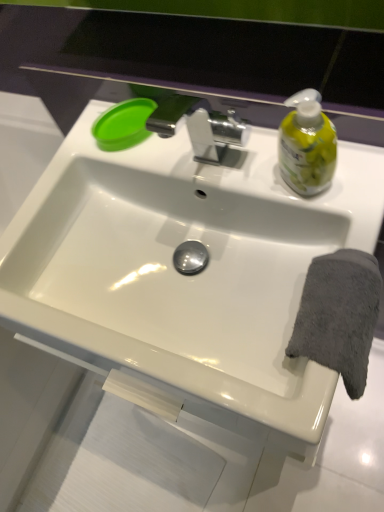
Question: Can you confirm if green plastic lid at upper left is positioned to the right of white glossy sink at center?

Choices:
 (A) yes
 (B) no

Answer: (B)

Question: Is green plastic lid at upper left closer to camera compared to white glossy sink at center?

Choices:
 (A) yes
 (B) no

Answer: (B)

Question: Is green plastic lid at upper left positioned beyond the bounds of white glossy sink at center?

Choices:
 (A) no
 (B) yes

Answer: (B)

Question: Is green plastic lid at upper left at the left side of white glossy sink at center?

Choices:
 (A) yes
 (B) no

Answer: (A)

Question: Can you confirm if green plastic lid at upper left is shorter than white glossy sink at center?

Choices:
 (A) yes
 (B) no

Answer: (A)

Question: Can you confirm if green plastic lid at upper left is thinner than white glossy sink at center?

Choices:
 (A) yes
 (B) no

Answer: (A)

Question: Is gray soft towel at right not inside green plastic lid at upper left?

Choices:
 (A) no
 (B) yes

Answer: (B)

Question: Can you confirm if gray soft towel at right is smaller than green plastic lid at upper left?

Choices:
 (A) no
 (B) yes

Answer: (A)

Question: From the image's perspective, does gray soft towel at right appear higher than green plastic lid at upper left?

Choices:
 (A) no
 (B) yes

Answer: (A)

Question: From a real-world perspective, does gray soft towel at right stand above green plastic lid at upper left?

Choices:
 (A) yes
 (B) no

Answer: (B)

Question: Is gray soft towel at right to the left of green plastic lid at upper left from the viewer's perspective?

Choices:
 (A) no
 (B) yes

Answer: (A)

Question: Is gray soft towel at right turned away from green plastic lid at upper left?

Choices:
 (A) yes
 (B) no

Answer: (A)

Question: Does white glossy sink at center appear on the left side of gray soft towel at right?

Choices:
 (A) yes
 (B) no

Answer: (A)